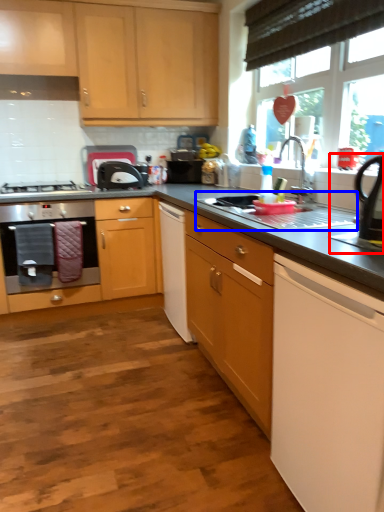
Question: Which point is closer to the camera, appliance (highlighted by a red box) or sink (highlighted by a blue box)?

Choices:
 (A) appliance
 (B) sink

Answer: (A)